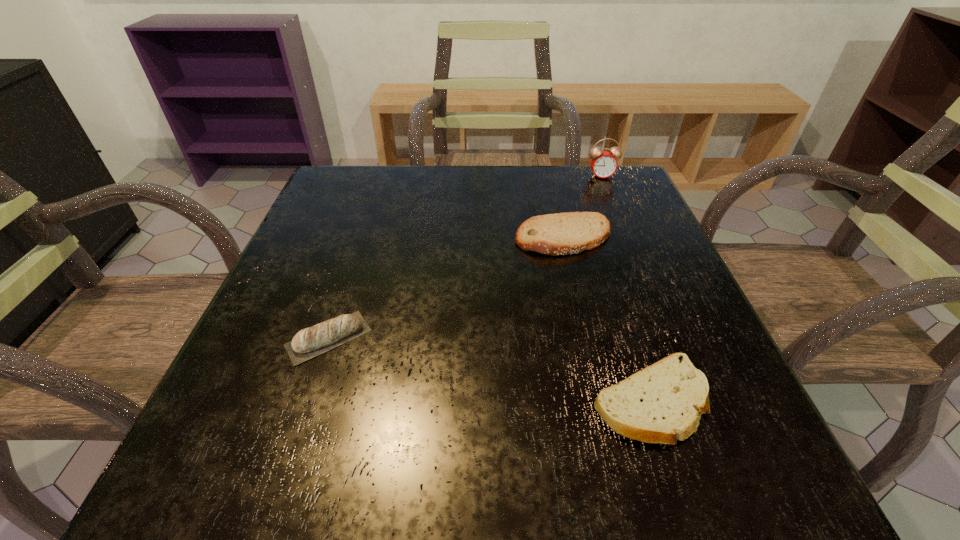
Identify the location of free spot between the third nearest object and the leftmost object. This screenshot has height=540, width=960. (446, 288).

Where is `unoccupied area between the leftmost object and the shortest object`? The image size is (960, 540). unoccupied area between the leftmost object and the shortest object is located at coordinates (490, 369).

You are a GUI agent. You are given a task and a screenshot of the screen. Output one action in this format:
    pyautogui.click(x=<x>, y=<y>)
    Task: Click on the empty space that is in between the leftmost object and the shortest pita bread
    This screenshot has width=960, height=540.
    Given the screenshot: What is the action you would take?
    pyautogui.click(x=490, y=369)

Identify the location of free spot between the farthest pita bread and the tallest object. (583, 207).

The image size is (960, 540). Find the location of `blank region between the leftmost object and the farthest pita bread`. blank region between the leftmost object and the farthest pita bread is located at coordinates (446, 288).

You are a GUI agent. You are given a task and a screenshot of the screen. Output one action in this format:
    pyautogui.click(x=<x>, y=<y>)
    Task: Click on the free spot between the leftmost pita bread and the farthest object
    Image resolution: width=960 pixels, height=540 pixels.
    Given the screenshot: What is the action you would take?
    pyautogui.click(x=465, y=256)

You are a GUI agent. You are given a task and a screenshot of the screen. Output one action in this format:
    pyautogui.click(x=<x>, y=<y>)
    Task: Click on the vacant area between the tallest object and the third nearest object
    The height and width of the screenshot is (540, 960).
    Given the screenshot: What is the action you would take?
    pyautogui.click(x=583, y=207)

The width and height of the screenshot is (960, 540). I want to click on free spot between the third nearest object and the shortest object, so click(607, 319).

I want to click on free point between the second farthest object and the alarm clock, so click(x=583, y=207).

In order to click on free spot between the farthest object and the shortest pita bread in this screenshot , I will do `click(626, 288)`.